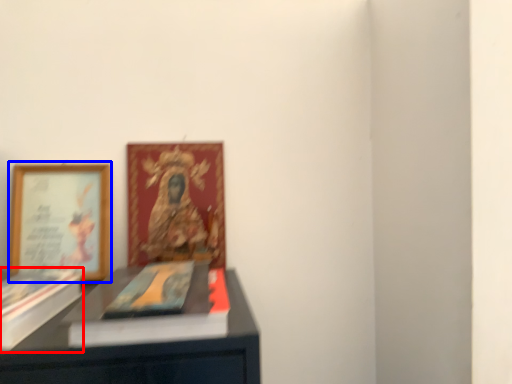
Question: Which of the following is the closest to the observer, paperback book (highlighted by a red box) or picture frame (highlighted by a blue box)?

Choices:
 (A) paperback book
 (B) picture frame

Answer: (A)